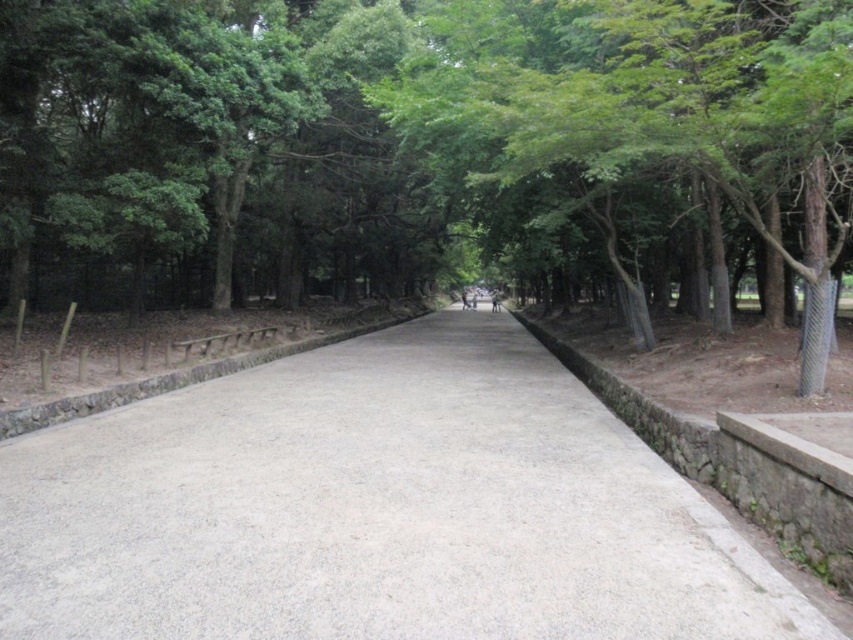
Question: Is green leafy tree at center above gray concrete pavement at center?

Choices:
 (A) no
 (B) yes

Answer: (B)

Question: Which of the following is the closest to the observer?

Choices:
 (A) (613, 488)
 (B) (280, 195)

Answer: (A)

Question: Which of the following is the closest to the observer?

Choices:
 (A) (492, 248)
 (B) (660, 592)

Answer: (B)

Question: Can you confirm if green leafy tree at center is smaller than gray concrete pavement at center?

Choices:
 (A) yes
 (B) no

Answer: (B)

Question: Does green leafy tree at center come behind gray concrete pavement at center?

Choices:
 (A) yes
 (B) no

Answer: (B)